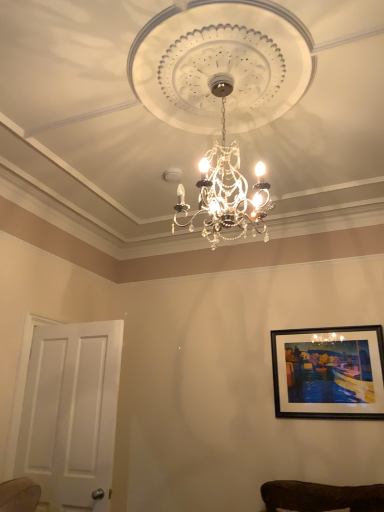
Question: Considering their positions, is black matte picture frame at upper right located in front of or behind crystal glass chandelier at center?

Choices:
 (A) behind
 (B) front

Answer: (A)

Question: Considering the positions of black matte picture frame at upper right and crystal glass chandelier at center in the image, is black matte picture frame at upper right bigger or smaller than crystal glass chandelier at center?

Choices:
 (A) small
 (B) big

Answer: (A)

Question: Which is farther from the black matte picture frame at upper right?

Choices:
 (A) crystal glass chandelier at center
 (B) white matte door at left

Answer: (B)

Question: Which of these objects is positioned closest to the crystal glass chandelier at center?

Choices:
 (A) white matte door at left
 (B) black matte picture frame at upper right

Answer: (A)